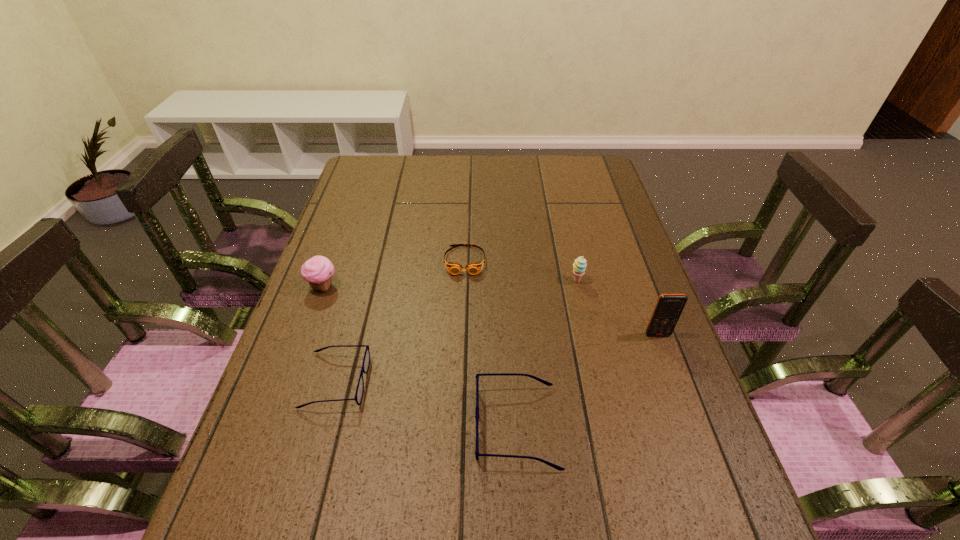
Considering the uniform spacing of spectacless, where should an additional spectacles be positioned on the right? Please locate a free spot. Please provide its 2D coordinates. Your answer should be formatted as a tuple, i.e. [(x, y)], where the tuple contains the x and y coordinates of a point satisfying the conditions above.

[(731, 480)]